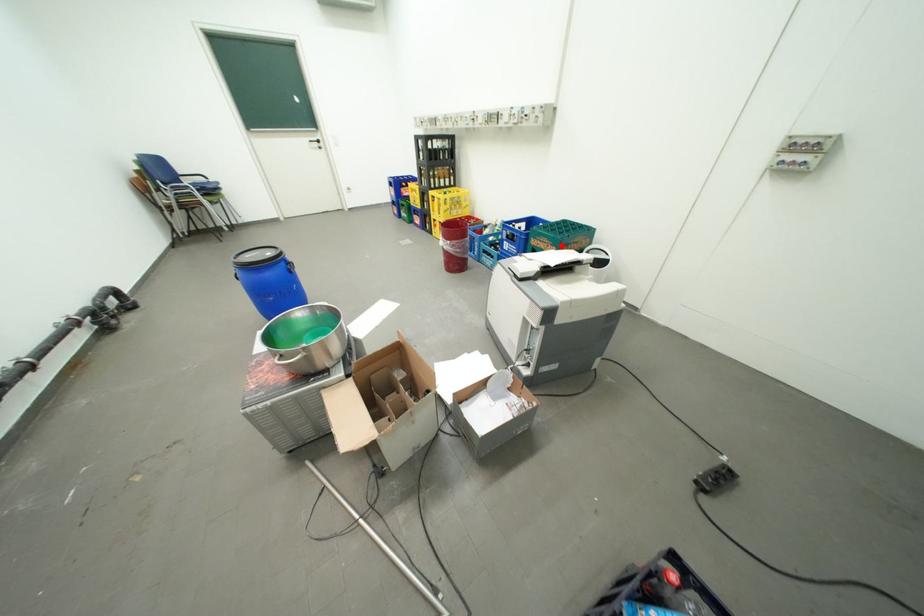
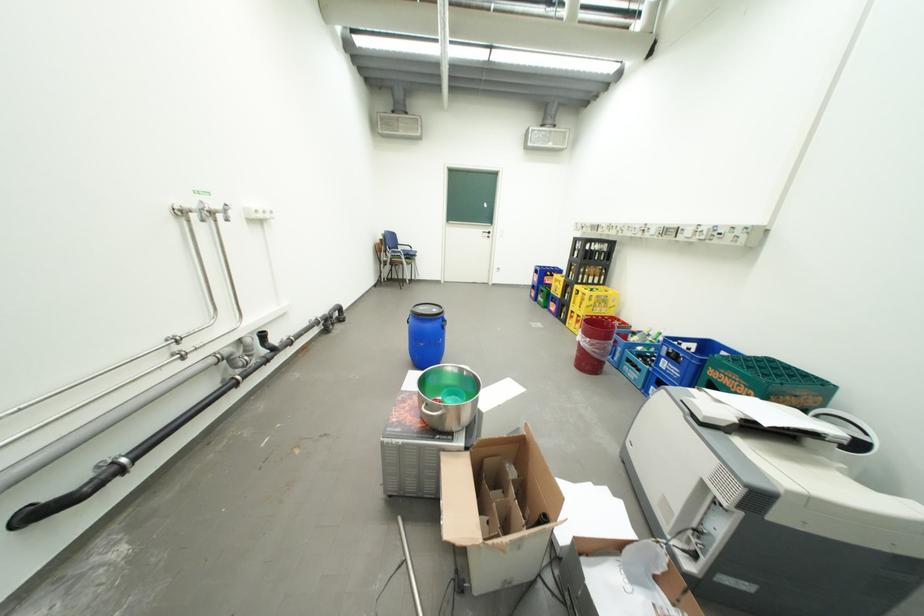
Locate, in the second image, the point that corresponds to the highlighted location in the first image.

(756, 387)